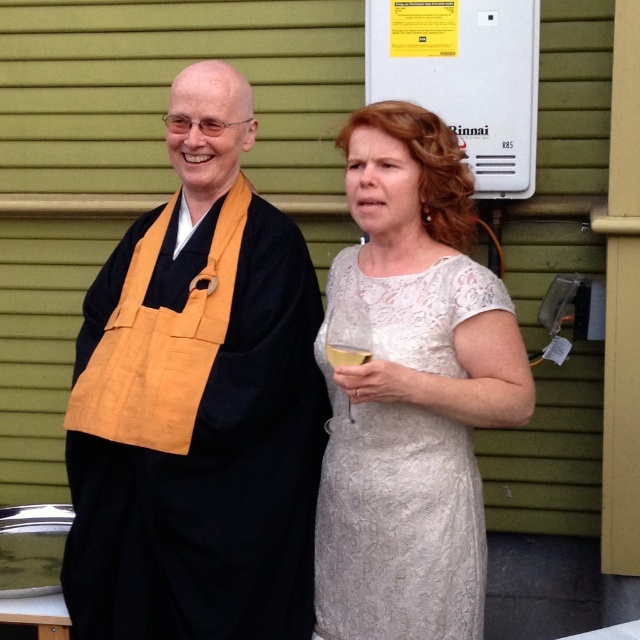
Question: Does black matte kimono at left appear over clear glass wine glass at lower center?

Choices:
 (A) yes
 (B) no

Answer: (B)

Question: Does lace fabric dress at center appear on the left side of clear glass wine glass at lower center?

Choices:
 (A) no
 (B) yes

Answer: (A)

Question: Considering the real-world distances, which object is farthest from the black matte kimono at left?

Choices:
 (A) translucent glass at upper center
 (B) clear glass wine glass at lower center
 (C) lace fabric dress at center

Answer: (A)

Question: Which point is closer to the camera?

Choices:
 (A) lace fabric dress at center
 (B) clear glass wine glass at lower center
 (C) translucent glass at upper center

Answer: (B)

Question: Observing the image, what is the correct spatial positioning of lace fabric dress at center in reference to translucent glass at upper center?

Choices:
 (A) right
 (B) left

Answer: (A)

Question: Which of the following is the closest to the observer?

Choices:
 (A) (328, 316)
 (B) (259, 211)
 (C) (333, 346)
 (D) (396, 608)

Answer: (D)